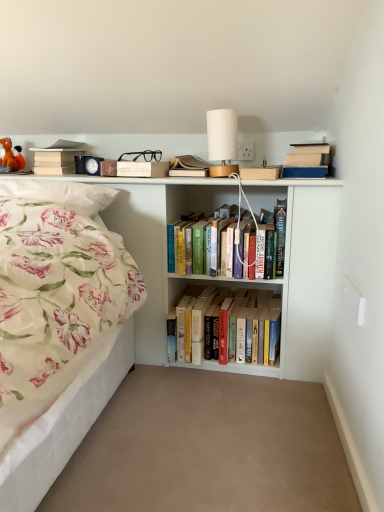
Question: Is the position of matte brown book at upper center more distant than that of orange plush toy at upper left?

Choices:
 (A) no
 (B) yes

Answer: (A)

Question: Is matte brown book at upper center thinner than orange plush toy at upper left?

Choices:
 (A) yes
 (B) no

Answer: (B)

Question: Considering the relative sizes of matte brown book at upper center and orange plush toy at upper left in the image provided, is matte brown book at upper center shorter than orange plush toy at upper left?

Choices:
 (A) yes
 (B) no

Answer: (A)

Question: Is matte brown book at upper center positioned far away from orange plush toy at upper left?

Choices:
 (A) no
 (B) yes

Answer: (A)

Question: Does matte brown book at upper center have a greater height compared to orange plush toy at upper left?

Choices:
 (A) yes
 (B) no

Answer: (B)

Question: Is floral fabric pillow at left taller or shorter than beige matte book at upper left, which is the first book from top to bottom?

Choices:
 (A) short
 (B) tall

Answer: (A)

Question: Visually, is floral fabric pillow at left positioned to the left or to the right of beige matte book at upper left, which appears as the 3th book when viewed from the right?

Choices:
 (A) right
 (B) left

Answer: (A)

Question: Is point (66, 189) closer or farther from the camera than point (66, 146)?

Choices:
 (A) closer
 (B) farther

Answer: (A)

Question: From the image's perspective, is floral fabric pillow at left positioned above or below beige matte book at upper left, which is the first book from top to bottom?

Choices:
 (A) above
 (B) below

Answer: (B)

Question: Considering the positions of beige carpet at center and orange plush toy at upper left in the image, is beige carpet at center bigger or smaller than orange plush toy at upper left?

Choices:
 (A) small
 (B) big

Answer: (B)

Question: From a real-world perspective, is beige carpet at center physically located above or below orange plush toy at upper left?

Choices:
 (A) above
 (B) below

Answer: (B)

Question: From their relative heights in the image, would you say beige carpet at center is taller or shorter than orange plush toy at upper left?

Choices:
 (A) short
 (B) tall

Answer: (A)

Question: Considering the positions of beige carpet at center and orange plush toy at upper left in the image, is beige carpet at center wider or thinner than orange plush toy at upper left?

Choices:
 (A) thin
 (B) wide

Answer: (B)

Question: Considering the positions of point (177, 309) and point (210, 116), is point (177, 309) closer or farther from the camera than point (210, 116)?

Choices:
 (A) farther
 (B) closer

Answer: (A)

Question: Is hardcover books at center, which is counted as the second book, starting from the left, taller or shorter than white matte table lamp at upper center?

Choices:
 (A) tall
 (B) short

Answer: (B)